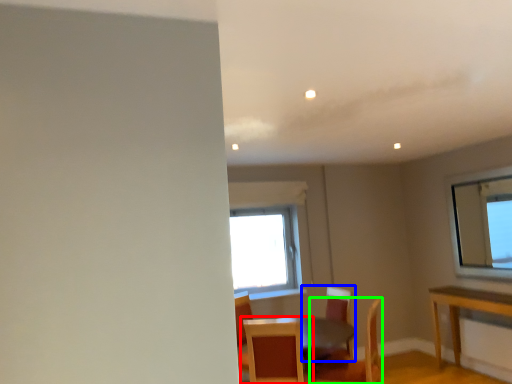
Question: Which object is positioned closest to chair (highlighted by a red box)? Select from chair (highlighted by a blue box) and chair (highlighted by a green box).

Choices:
 (A) chair
 (B) chair

Answer: (A)